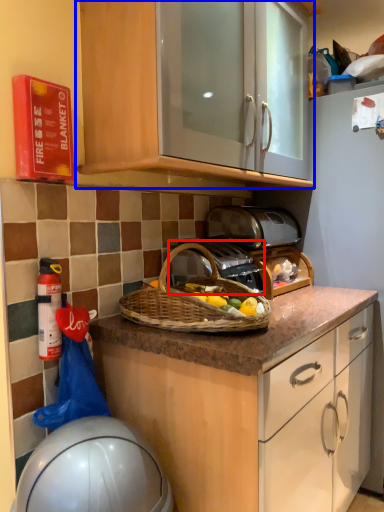
Question: Which of the following is the farthest to the observer, gas stove (highlighted by a red box) or cabinetry (highlighted by a blue box)?

Choices:
 (A) gas stove
 (B) cabinetry

Answer: (A)